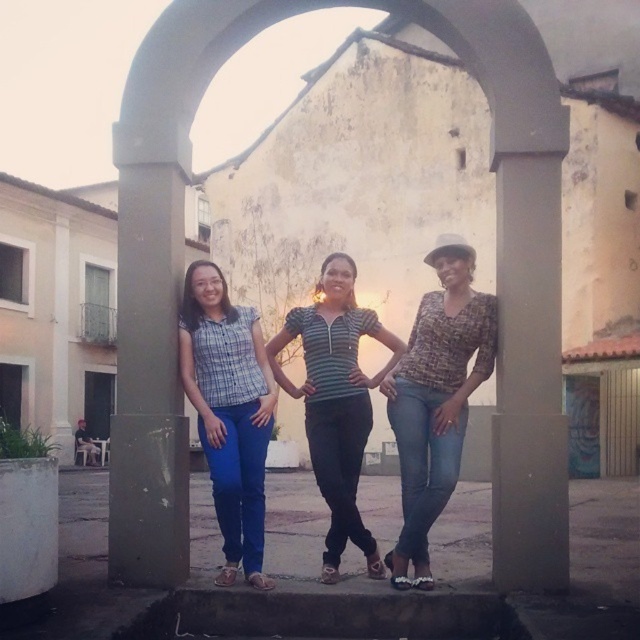
Is point (77, 513) in front of point (317, 464)?

No, it is not.

Which is more to the right, blue jeans at center or striped fabric shirt at center?

Positioned to the right is striped fabric shirt at center.

Find the location of a particular element. blue jeans at center is located at coordinates (348, 576).

Is concrete at center thinner than blue jeans at center?

Yes.

Is point (500, 449) positioned in front of point (198, 548)?

Yes, it is.

Between point (540, 225) and point (268, 516), which one is positioned behind?

Point (268, 516)

At what (x,y) coordinates should I click in order to perform the action: click on concrete at center. Please return your answer as a coordinate pair (x, y). Looking at the image, I should click on (497, 266).

Can you confirm if concrete at center is positioned above striped fabric shirt at center?

Correct, concrete at center is located above striped fabric shirt at center.

Between concrete at center and striped fabric shirt at center, which one is positioned lower?

striped fabric shirt at center is below.

Which is in front, point (502, 440) or point (364, 376)?

Point (502, 440) is in front.

This screenshot has width=640, height=640. Identify the location of concrete at center. tap(497, 266).